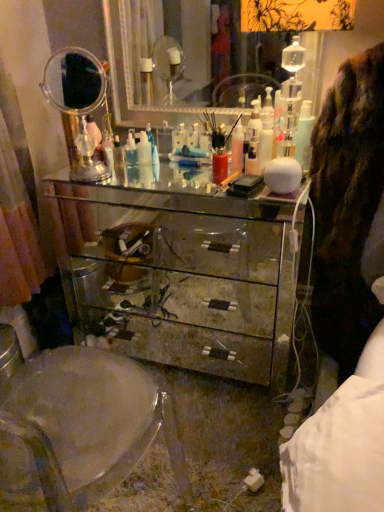
Question: Is the depth of white glossy bottle at upper right greater than that of silver mirrored dresser at upper center, the 1th mirror viewed from the right?

Choices:
 (A) yes
 (B) no

Answer: (B)

Question: Can you confirm if white glossy bottle at upper right is shorter than silver mirrored dresser at upper center, which is the second mirror from left to right?

Choices:
 (A) yes
 (B) no

Answer: (A)

Question: Can you confirm if white glossy bottle at upper right is thinner than silver mirrored dresser at upper center, the 1th mirror viewed from the right?

Choices:
 (A) yes
 (B) no

Answer: (A)

Question: From a real-world perspective, is white glossy bottle at upper right below silver mirrored dresser at upper center, which is the second mirror from left to right?

Choices:
 (A) no
 (B) yes

Answer: (B)

Question: Could you tell me if white glossy bottle at upper right is facing silver mirrored dresser at upper center, the 1th mirror viewed from the right?

Choices:
 (A) no
 (B) yes

Answer: (A)

Question: Considering the relative positions of clear glass mirror at upper left, the second mirror viewed from the right, and mirrored glass chest of drawers at center in the image provided, is clear glass mirror at upper left, the second mirror viewed from the right, to the left or to the right of mirrored glass chest of drawers at center?

Choices:
 (A) right
 (B) left

Answer: (B)

Question: In terms of size, does clear glass mirror at upper left, the second mirror viewed from the right, appear bigger or smaller than mirrored glass chest of drawers at center?

Choices:
 (A) big
 (B) small

Answer: (B)

Question: Which is correct: clear glass mirror at upper left, the second mirror viewed from the right, is inside mirrored glass chest of drawers at center, or outside of it?

Choices:
 (A) outside
 (B) inside

Answer: (A)

Question: Considering their positions, is clear glass mirror at upper left, positioned as the first mirror in left-to-right order, located in front of or behind mirrored glass chest of drawers at center?

Choices:
 (A) behind
 (B) front

Answer: (A)

Question: From a real-world perspective, is transparent plastic swivel chair at center physically located above or below white glossy bottle at upper right?

Choices:
 (A) below
 (B) above

Answer: (A)

Question: Do you think transparent plastic swivel chair at center is within white glossy bottle at upper right, or outside of it?

Choices:
 (A) inside
 (B) outside

Answer: (B)

Question: Is transparent plastic swivel chair at center in front of or behind white glossy bottle at upper right in the image?

Choices:
 (A) behind
 (B) front

Answer: (B)

Question: Is transparent plastic swivel chair at center wider or thinner than white glossy bottle at upper right?

Choices:
 (A) wide
 (B) thin

Answer: (A)

Question: Is transparent plastic swivel chair at center in front of or behind silver mirrored dresser at upper center, which is the second mirror from left to right, in the image?

Choices:
 (A) front
 (B) behind

Answer: (A)

Question: From the image's perspective, relative to silver mirrored dresser at upper center, the 1th mirror viewed from the right, is transparent plastic swivel chair at center above or below?

Choices:
 (A) below
 (B) above

Answer: (A)